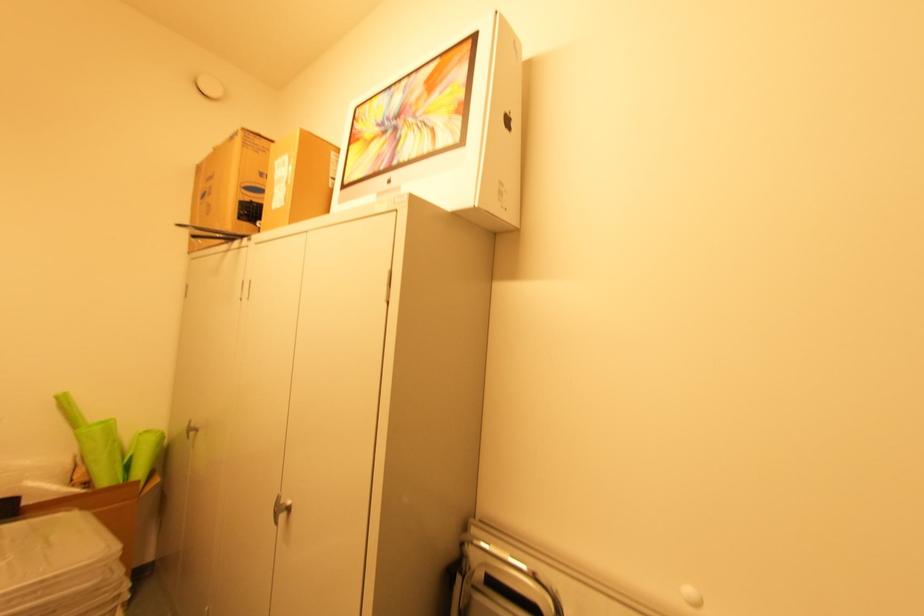
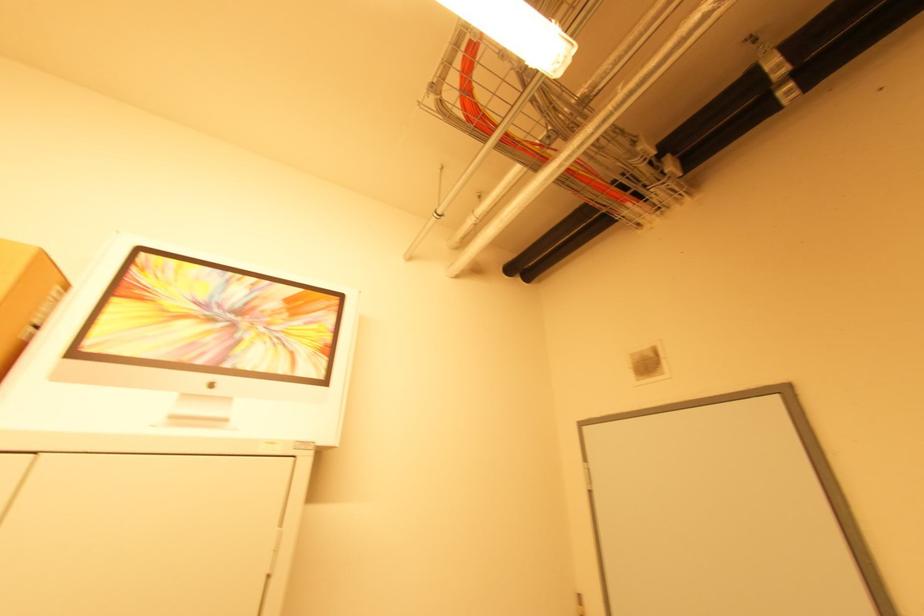
Find the pixel in the second image that matches point 334,180 in the first image.

(32, 329)